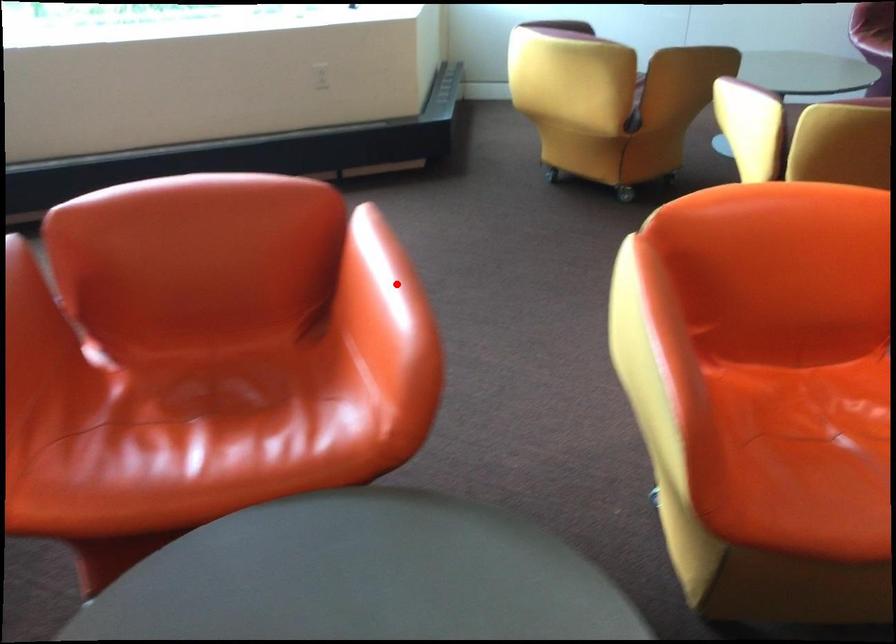
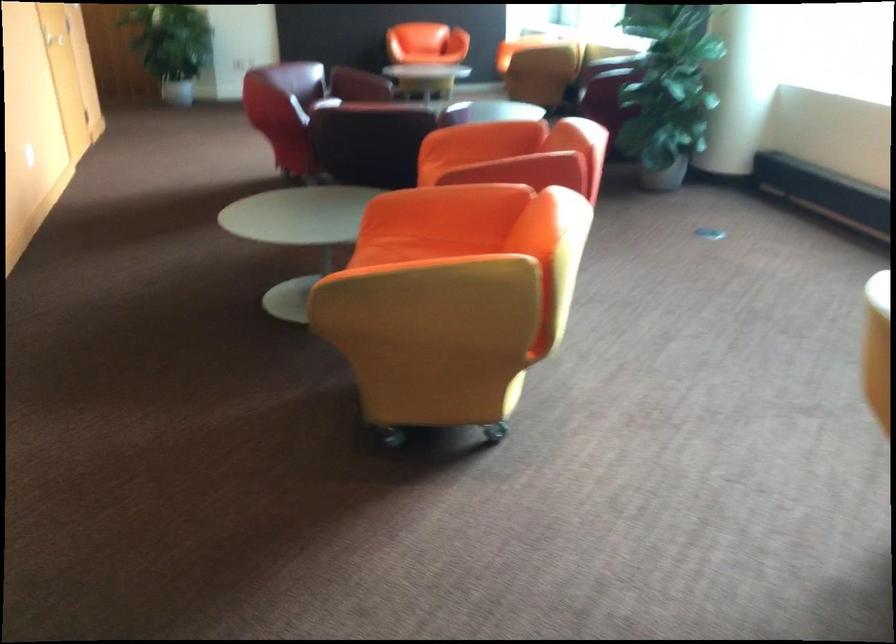
Question: I am providing you with two images of the same scene from different viewpoints. A red point is marked on the first image. Is the red point's position out of view in image 2?

Choices:
 (A) Yes
 (B) No

Answer: (A)